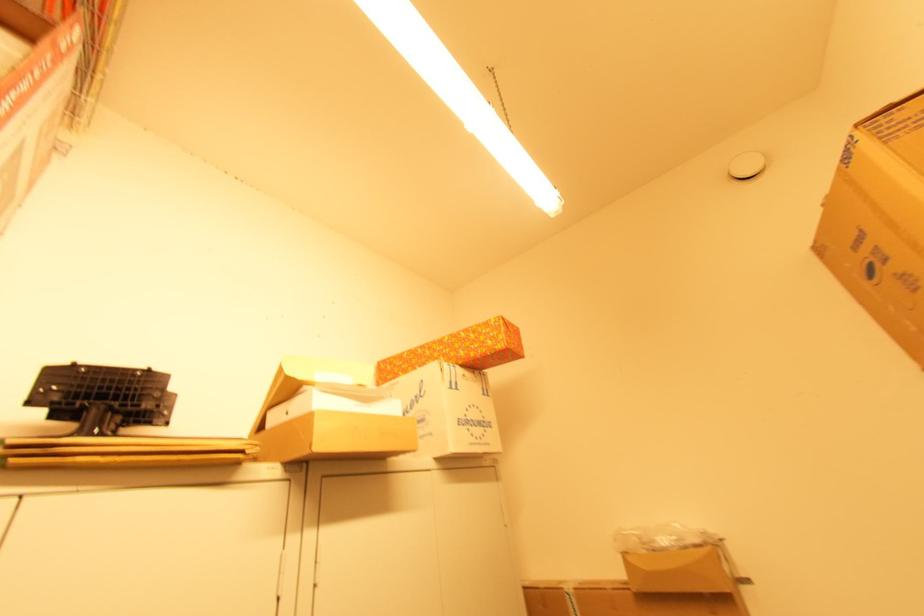
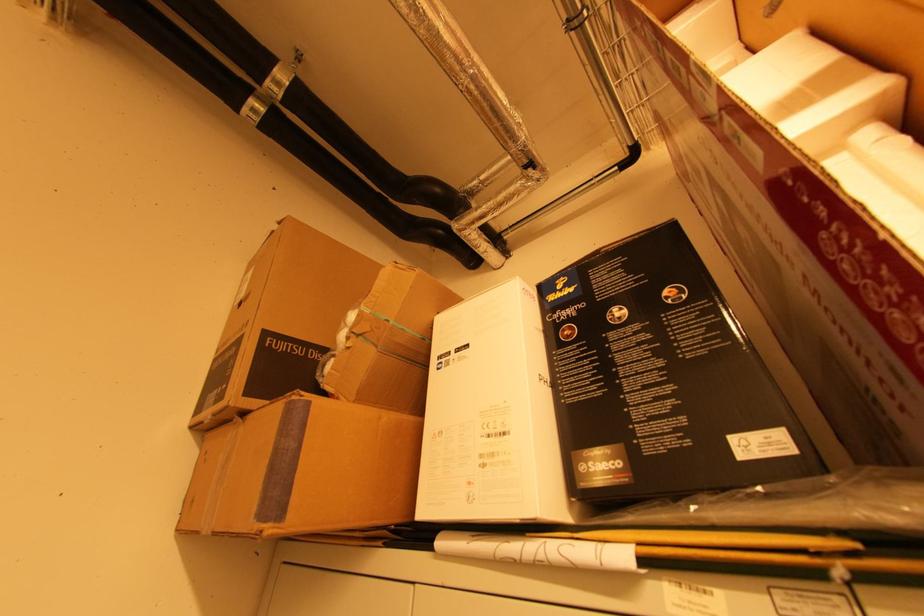
The images are taken continuously from a first-person perspective. In which direction is your viewpoint rotating?

The camera rotated toward left-up.